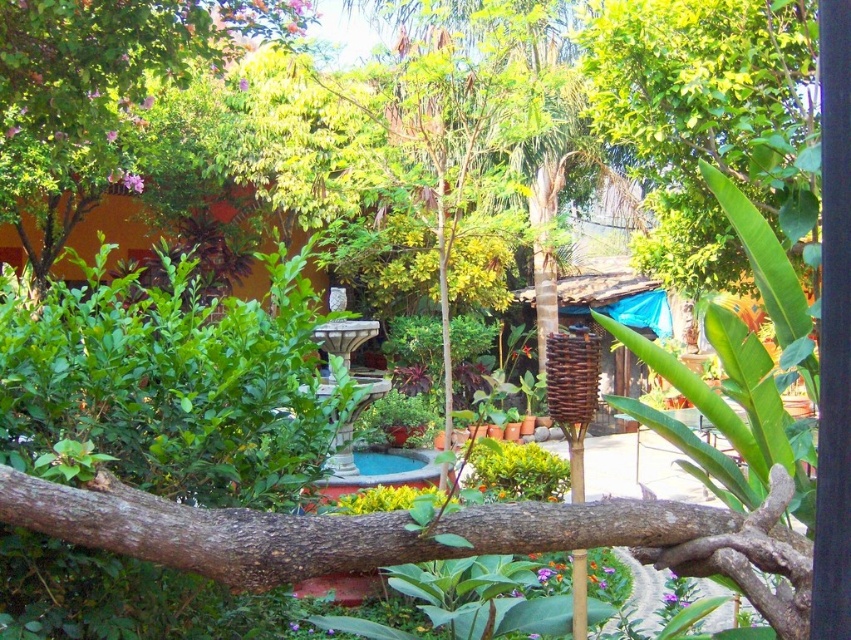
Question: Which object is closer to the camera taking this photo?

Choices:
 (A) brown rough tree branch at center
 (B) green leafy bush at left

Answer: (A)

Question: Which point is farther to the camera?

Choices:
 (A) brown rough tree branch at center
 (B) green leafy bush at left

Answer: (B)

Question: Does green leafy bush at left have a lesser width compared to brown rough tree branch at center?

Choices:
 (A) yes
 (B) no

Answer: (B)

Question: Which point is farther to the camera?

Choices:
 (A) green leafy bush at left
 (B) brown rough tree branch at center

Answer: (A)

Question: Does green leafy bush at left appear under brown rough tree branch at center?

Choices:
 (A) no
 (B) yes

Answer: (A)

Question: Does green leafy bush at left have a larger size compared to brown rough tree branch at center?

Choices:
 (A) yes
 (B) no

Answer: (A)